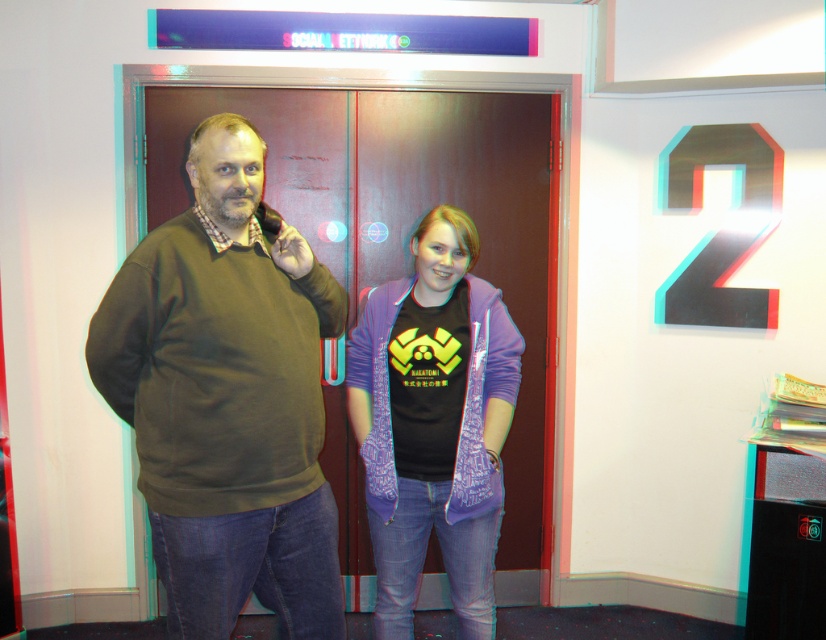
Question: Considering the relative positions of matte green sweater at center and purple cotton jacket at center in the image provided, where is matte green sweater at center located with respect to purple cotton jacket at center?

Choices:
 (A) above
 (B) below

Answer: (A)

Question: Does matte green sweater at center appear over purple cotton jacket at center?

Choices:
 (A) yes
 (B) no

Answer: (A)

Question: Which of the following is the farthest from the observer?

Choices:
 (A) (463, 332)
 (B) (174, 595)

Answer: (A)

Question: Which of the following is the closest to the observer?

Choices:
 (A) (331, 545)
 (B) (409, 276)

Answer: (A)

Question: Is matte green sweater at center to the left of purple cotton jacket at center from the viewer's perspective?

Choices:
 (A) no
 (B) yes

Answer: (B)

Question: Which object is farther from the camera taking this photo?

Choices:
 (A) purple cotton jacket at center
 (B) matte green sweater at center

Answer: (A)